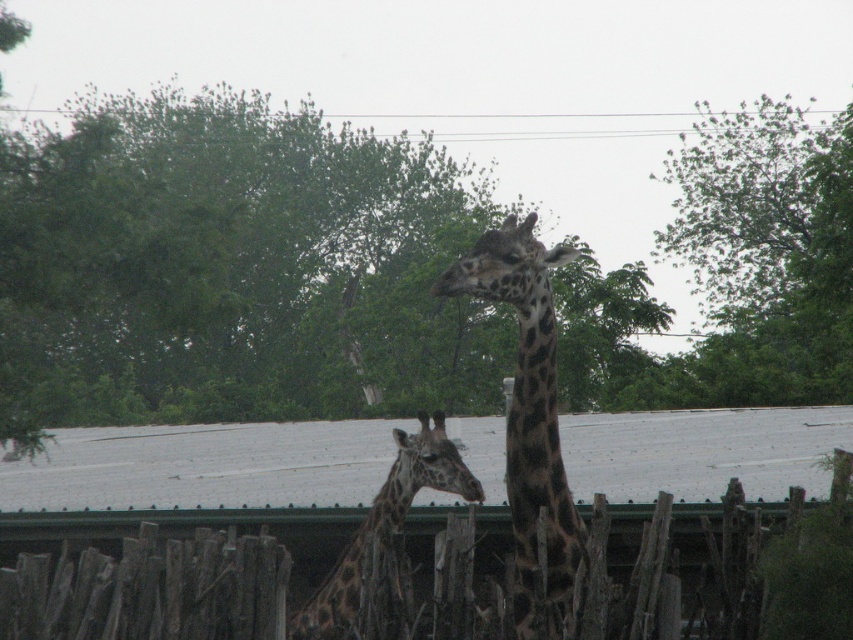
You are a zookeeper who needs to ensure the wooden fence at center can safely contain the spotted brown giraffe at center. Based on the scene, is the fence large enough to prevent the giraffe from escaping?

The wooden fence at center has a smaller size compared to the spotted brown giraffe at center, which means the fence may not be tall or wide enough to contain the giraffe, posing a potential escape risk.

You are a zookeeper who wants to ensure the safety of the spotted brown giraffe at center. Given that the wooden fence at center is shorter than the giraffe, would the giraffe be able to jump over the fence?

The wooden fence at center is shorter than the spotted brown giraffe at center, so the giraffe could potentially jump over the fence, posing a safety risk.